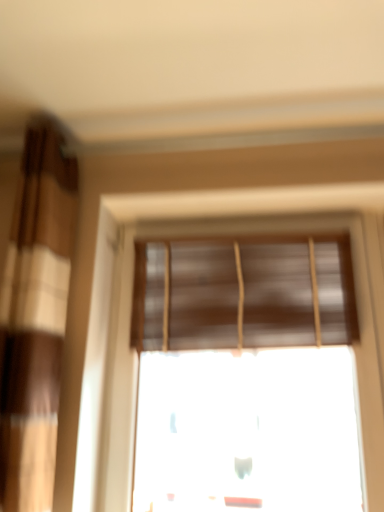
Question: Is brown matte blinds at center not inside brown textured curtain at left?

Choices:
 (A) yes
 (B) no

Answer: (A)

Question: Does brown matte blinds at center appear on the left side of brown textured curtain at left?

Choices:
 (A) no
 (B) yes

Answer: (A)

Question: Is brown matte blinds at center at the right side of brown textured curtain at left?

Choices:
 (A) no
 (B) yes

Answer: (B)

Question: From the image's perspective, does brown matte blinds at center appear higher than brown textured curtain at left?

Choices:
 (A) no
 (B) yes

Answer: (A)

Question: Can you confirm if brown matte blinds at center is shorter than brown textured curtain at left?

Choices:
 (A) no
 (B) yes

Answer: (B)

Question: Is brown matte blinds at center touching brown textured curtain at left?

Choices:
 (A) yes
 (B) no

Answer: (B)

Question: Is brown textured curtain at left oriented away from brown matte window blind at upper center?

Choices:
 (A) no
 (B) yes

Answer: (A)

Question: Can you confirm if brown textured curtain at left is positioned to the right of brown matte window blind at upper center?

Choices:
 (A) no
 (B) yes

Answer: (A)

Question: Is brown textured curtain at left in front of brown matte window blind at upper center?

Choices:
 (A) yes
 (B) no

Answer: (A)

Question: From the image's perspective, is brown textured curtain at left above brown matte window blind at upper center?

Choices:
 (A) no
 (B) yes

Answer: (B)

Question: Considering the relative sizes of brown textured curtain at left and brown matte window blind at upper center in the image provided, is brown textured curtain at left thinner than brown matte window blind at upper center?

Choices:
 (A) no
 (B) yes

Answer: (A)

Question: Is brown textured curtain at left located outside brown matte window blind at upper center?

Choices:
 (A) yes
 (B) no

Answer: (A)

Question: Is brown textured curtain at left positioned in front of brown matte blinds at center?

Choices:
 (A) no
 (B) yes

Answer: (B)